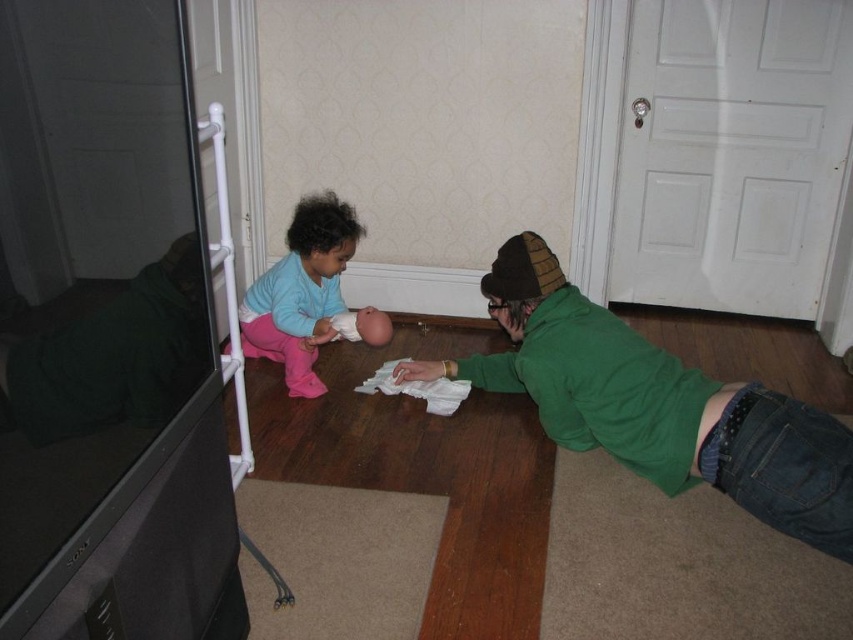
Question: Which point appears closest to the camera in this image?

Choices:
 (A) (242, 349)
 (B) (558, 385)

Answer: (B)

Question: Can you confirm if green soft sweater at lower right is smaller than matte blue sweater at center?

Choices:
 (A) no
 (B) yes

Answer: (A)

Question: Is green soft sweater at lower right to the right of matte blue sweater at center from the viewer's perspective?

Choices:
 (A) yes
 (B) no

Answer: (A)

Question: Is the position of green soft sweater at lower right more distant than that of matte blue sweater at center?

Choices:
 (A) yes
 (B) no

Answer: (B)